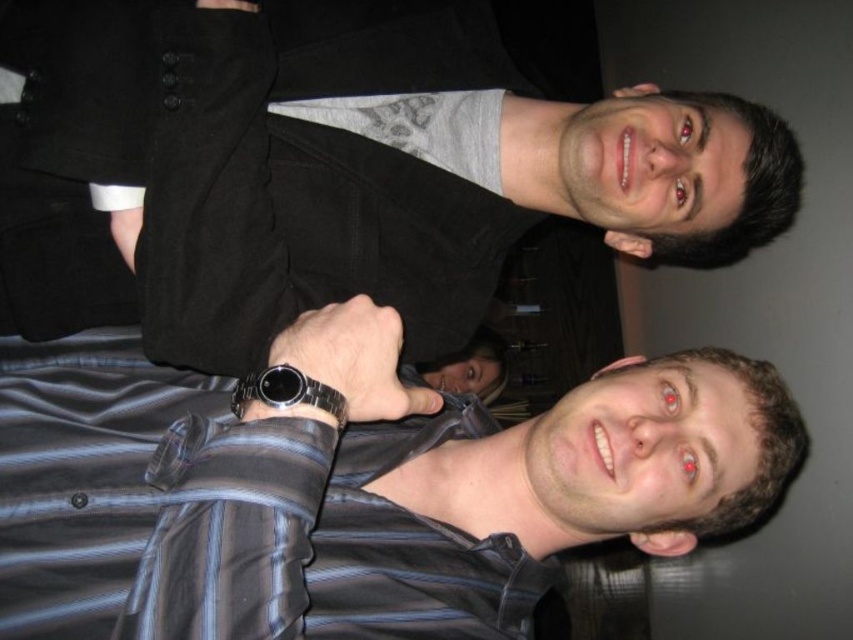
Question: Which object is positioned farthest from the black matte shirt at upper center?

Choices:
 (A) striped fabric shirt at lower left
 (B) sleek metal watch at center

Answer: (B)

Question: Can you confirm if black matte shirt at upper center is positioned above striped fabric shirt at lower left?

Choices:
 (A) no
 (B) yes

Answer: (B)

Question: Which of these objects is positioned closest to the black matte shirt at upper center?

Choices:
 (A) striped fabric shirt at lower left
 (B) sleek metal watch at center

Answer: (A)

Question: Considering the relative positions of striped fabric shirt at lower left and sleek metal watch at center in the image provided, where is striped fabric shirt at lower left located with respect to sleek metal watch at center?

Choices:
 (A) above
 (B) below

Answer: (B)

Question: Is black matte shirt at upper center thinner than striped fabric shirt at lower left?

Choices:
 (A) yes
 (B) no

Answer: (B)

Question: Which of the following is the farthest from the observer?

Choices:
 (A) sleek metal watch at center
 (B) striped fabric shirt at lower left
 (C) black matte shirt at upper center

Answer: (C)